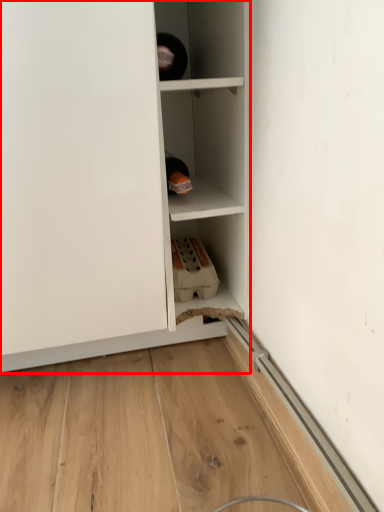
Question: From the image's perspective, where is cupboard (annotated by the red box) located relative to cabinetry?

Choices:
 (A) below
 (B) above

Answer: (A)